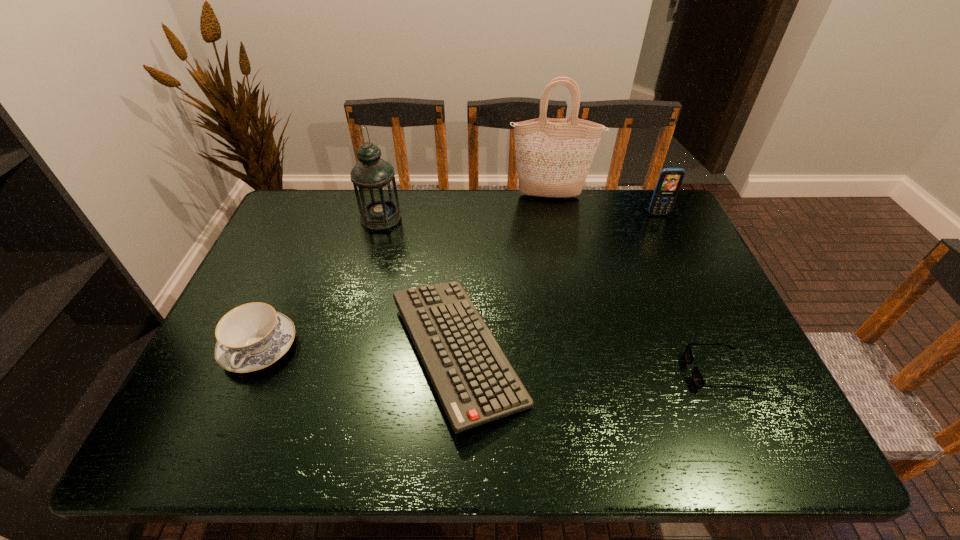
I want to click on vacant region located 0.210m on the front of the oil lamp, so click(x=366, y=279).

At what (x,y) coordinates should I click in order to perform the action: click on vacant space positioned on the screen of the third tallest object. Please return your answer as a coordinate pair (x, y). This screenshot has height=540, width=960. Looking at the image, I should click on (678, 255).

Find the location of `vacant space located with the handle on the side of the chinaware`. vacant space located with the handle on the side of the chinaware is located at coordinates (236, 402).

The width and height of the screenshot is (960, 540). What are the coordinates of `free spot located 0.170m on the left of the second shortest object` in the screenshot? It's located at (317, 353).

I want to click on free spot located on the front-facing side of the shortest object, so click(580, 372).

Image resolution: width=960 pixels, height=540 pixels. Find the location of `blank space located on the front-facing side of the shortest object`. blank space located on the front-facing side of the shortest object is located at coordinates (662, 372).

This screenshot has height=540, width=960. I want to click on vacant space located 0.330m on the front-facing side of the shortest object, so click(545, 372).

Where is `shopping bag that is at the far edge`? shopping bag that is at the far edge is located at coordinates click(553, 156).

Locate an element on the screen. oil lamp at the far edge is located at coordinates (373, 179).

Find the location of a particular element. The image size is (960, 540). cellular telephone at the far edge is located at coordinates (669, 181).